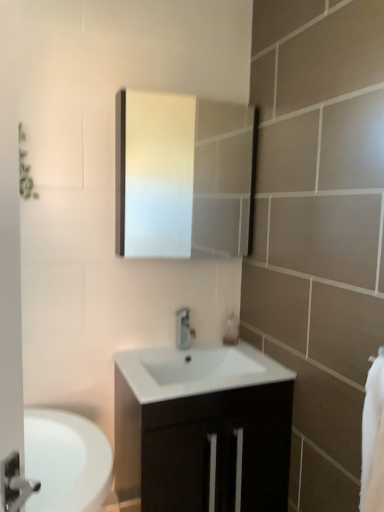
Question: Is silver metallic faucet at center wider than white glossy sink at center?

Choices:
 (A) yes
 (B) no

Answer: (B)

Question: Can you confirm if silver metallic faucet at center is smaller than white glossy sink at center?

Choices:
 (A) yes
 (B) no

Answer: (A)

Question: Is silver metallic faucet at center beside white glossy sink at center?

Choices:
 (A) yes
 (B) no

Answer: (B)

Question: From a real-world perspective, is silver metallic faucet at center located higher than white glossy sink at center?

Choices:
 (A) no
 (B) yes

Answer: (B)

Question: From a real-world perspective, is silver metallic faucet at center located beneath white glossy sink at center?

Choices:
 (A) yes
 (B) no

Answer: (B)

Question: Do you think silver metallic faucet at center is within white glossy sink at center, or outside of it?

Choices:
 (A) inside
 (B) outside

Answer: (B)

Question: Is point (187, 336) positioned closer to the camera than point (221, 362)?

Choices:
 (A) farther
 (B) closer

Answer: (A)

Question: From a real-world perspective, relative to white glossy sink at center, is silver metallic faucet at center vertically above or below?

Choices:
 (A) above
 (B) below

Answer: (A)

Question: Based on their sizes in the image, would you say silver metallic faucet at center is bigger or smaller than white glossy sink at center?

Choices:
 (A) small
 (B) big

Answer: (A)

Question: Is white soft towel at right inside the boundaries of white glossy medicine cabinet at upper center, or outside?

Choices:
 (A) outside
 (B) inside

Answer: (A)

Question: Is point (364, 426) positioned closer to the camera than point (183, 195)?

Choices:
 (A) farther
 (B) closer

Answer: (B)

Question: In terms of width, does white soft towel at right look wider or thinner when compared to white glossy medicine cabinet at upper center?

Choices:
 (A) thin
 (B) wide

Answer: (A)

Question: From a real-world perspective, is white soft towel at right above or below white glossy medicine cabinet at upper center?

Choices:
 (A) below
 (B) above

Answer: (A)

Question: Considering the positions of white glossy sink at center and white glossy medicine cabinet at upper center in the image, is white glossy sink at center wider or thinner than white glossy medicine cabinet at upper center?

Choices:
 (A) thin
 (B) wide

Answer: (B)

Question: Based on their sizes in the image, would you say white glossy sink at center is bigger or smaller than white glossy medicine cabinet at upper center?

Choices:
 (A) small
 (B) big

Answer: (A)